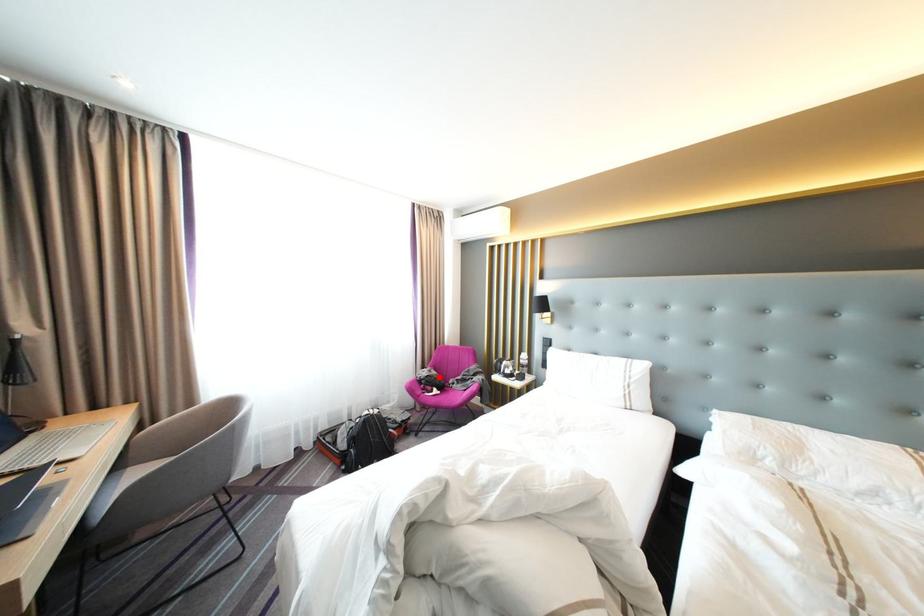
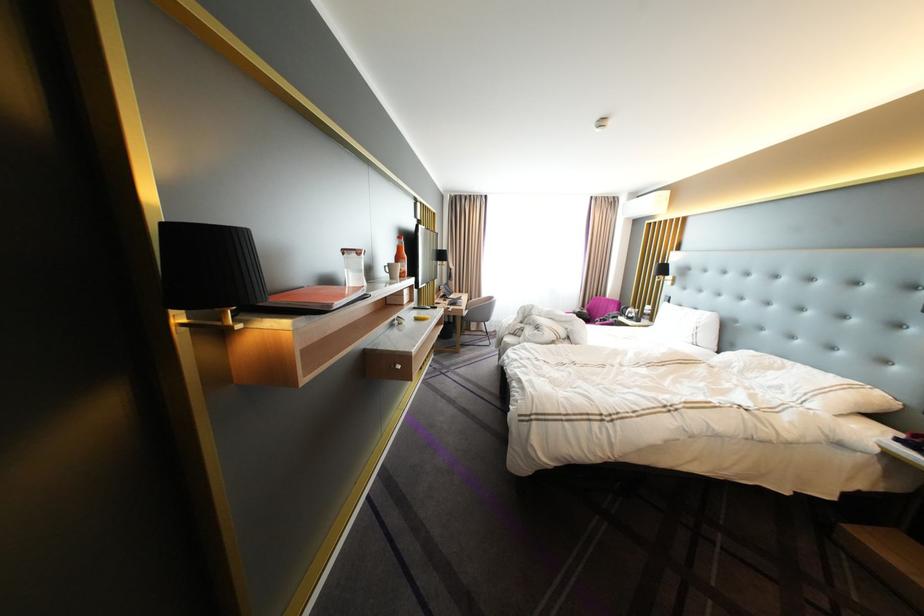
In the second image, find the point that corresponds to the highlighted location in the first image.

(590, 313)